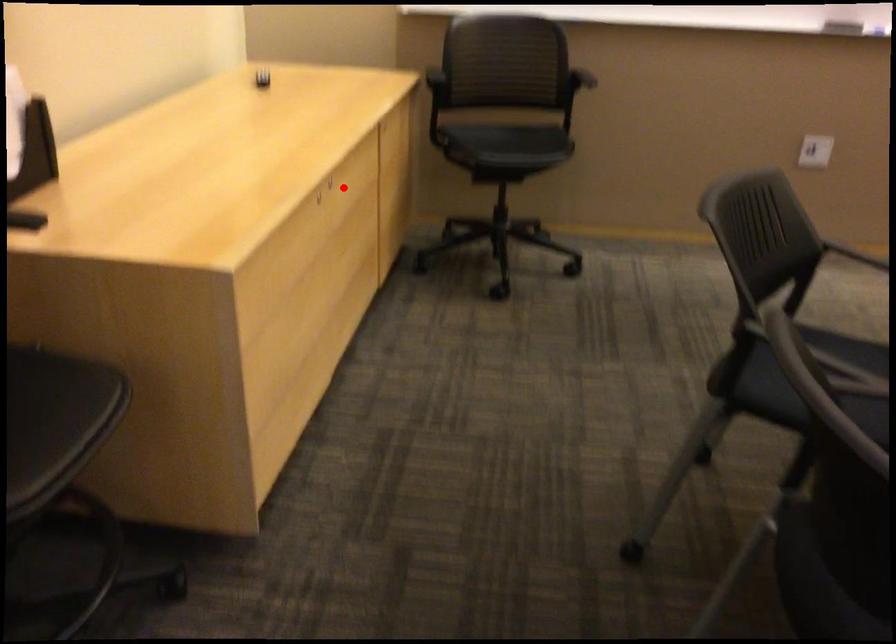
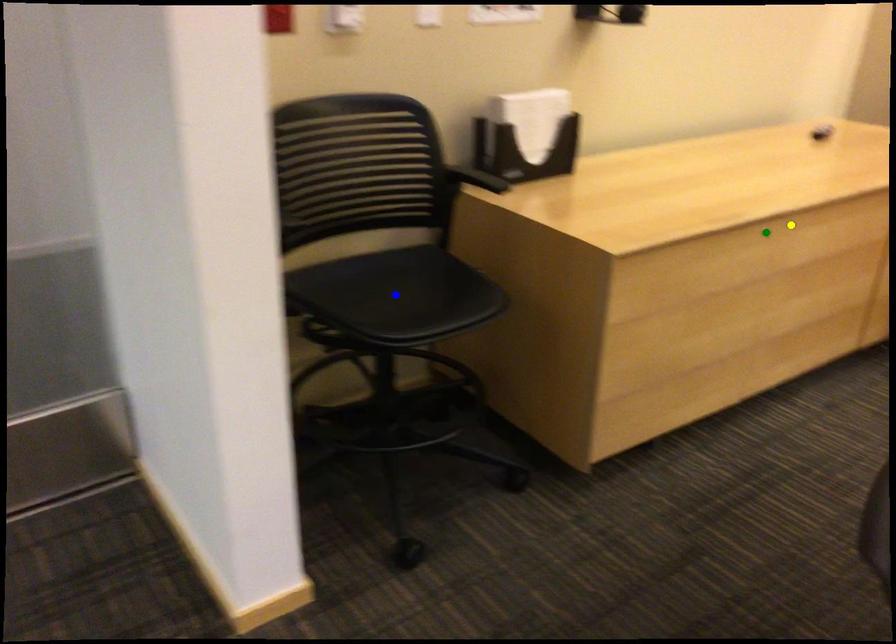
Question: I am providing you with two images of the same scene from different viewpoints. A red point is marked on the first image. You are given multiple points on the second image. Which spot in image 2 lines up with the point in image 1?

Choices:
 (A) yellow point
 (B) green point
 (C) blue point

Answer: (A)